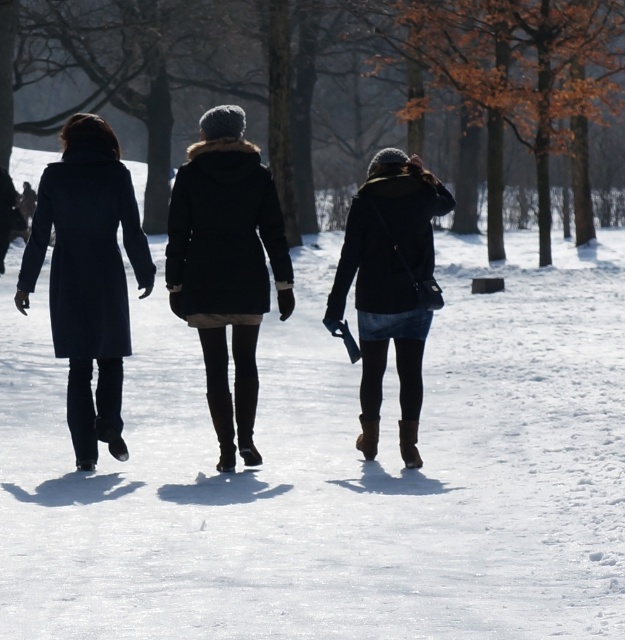
You are standing at the origin point of the coordinate system. The image shows three people walking away from you on a snowy path. You need to locate the matte black coat at left. What are its coordinates?

The coordinates of the matte black coat at left are at point [88,276].

You are a photographer trying to capture the two people wearing matte black coats in the scene. Since both are wearing similar coats, how can you distinguish between the matte black coat at center and the matte black coat at left in your photo?

The matte black coat at center has a smaller size compared to the matte black coat at left, so you can distinguish them by noting that the one at the center is smaller in size than the one on the left.